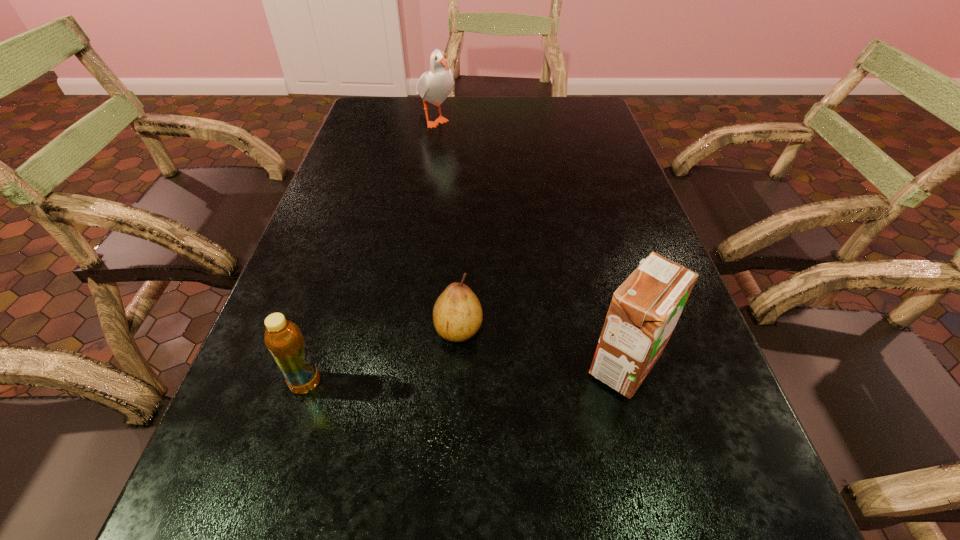
Identify the location of free area in between the rightmost object and the pear. The image size is (960, 540). (541, 347).

This screenshot has width=960, height=540. In order to click on vacant area between the farthest object and the rightmost object in this screenshot , I will do `click(530, 242)`.

The image size is (960, 540). Find the location of `free space that is in between the pear and the second shortest object`. free space that is in between the pear and the second shortest object is located at coordinates (382, 356).

This screenshot has height=540, width=960. In order to click on blank region between the leftmost object and the farthest object in this screenshot , I will do `click(371, 251)`.

Identify the location of blank region between the farthest object and the bottle. The height and width of the screenshot is (540, 960). (371, 251).

I want to click on free space between the farthest object and the carton, so click(x=530, y=242).

Find the location of `free space between the leftmost object and the farthest object`. free space between the leftmost object and the farthest object is located at coordinates (371, 251).

The height and width of the screenshot is (540, 960). Find the location of `free space between the third tallest object and the gull`. free space between the third tallest object and the gull is located at coordinates (371, 251).

Locate which object is the closest to the gull. Please provide its 2D coordinates. Your answer should be formatted as a tuple, i.e. [(x, y)], where the tuple contains the x and y coordinates of a point satisfying the conditions above.

[(457, 314)]

Image resolution: width=960 pixels, height=540 pixels. I want to click on object that stands as the third closest to the leftmost object, so click(x=434, y=86).